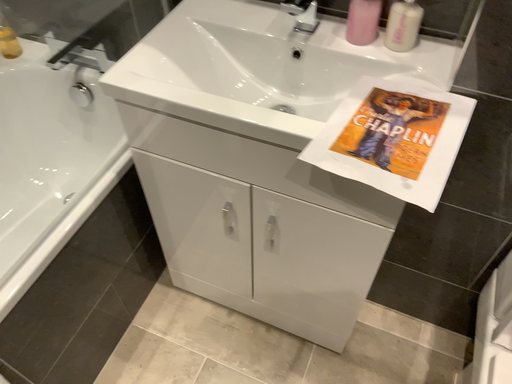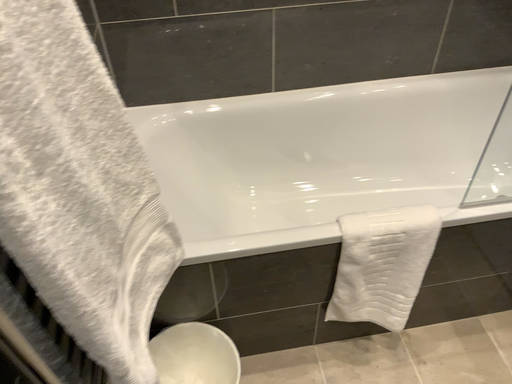
Question: How did the camera likely rotate when shooting the video?

Choices:
 (A) rotated upward
 (B) rotated downward

Answer: (A)